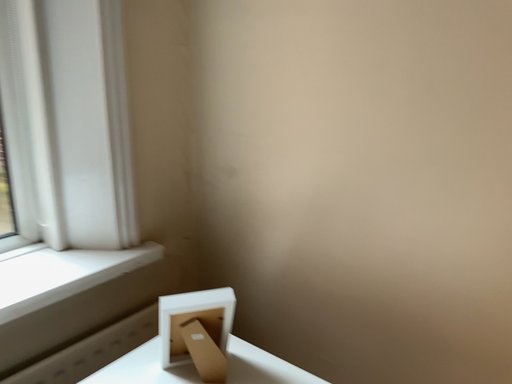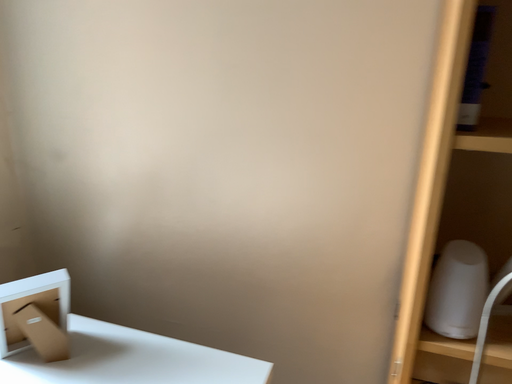
Question: How did the camera likely rotate when shooting the video?

Choices:
 (A) rotated left
 (B) rotated right

Answer: (B)